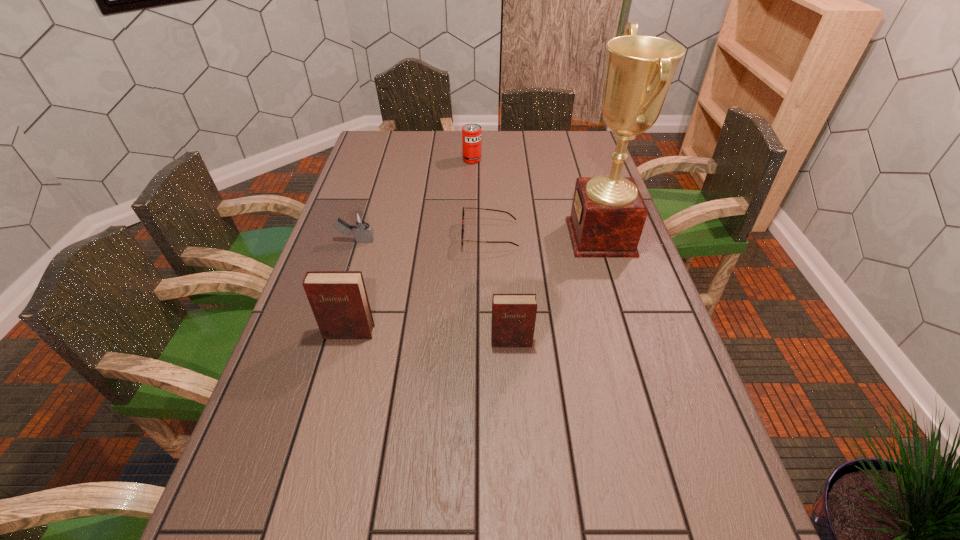
What are the coordinates of `the left diary` in the screenshot? It's located at (338, 299).

Identify the location of the second tallest object. pos(338,299).

The width and height of the screenshot is (960, 540). Find the location of `the right diary`. the right diary is located at coordinates (513, 315).

Where is `can`? can is located at coordinates (471, 133).

Where is `the shortest object`? This screenshot has height=540, width=960. the shortest object is located at coordinates (462, 240).

Where is `the fifth tallest object`? the fifth tallest object is located at coordinates (363, 233).

Locate an element on the screen. trophy cup is located at coordinates (608, 213).

I want to click on the tallest object, so click(x=608, y=213).

Where is `vacant region located on the front cover of the fifth shortest object`? Image resolution: width=960 pixels, height=540 pixels. vacant region located on the front cover of the fifth shortest object is located at coordinates (341, 363).

Image resolution: width=960 pixels, height=540 pixels. Identify the location of vacant position located 0.120m on the front cover of the right diary. (515, 392).